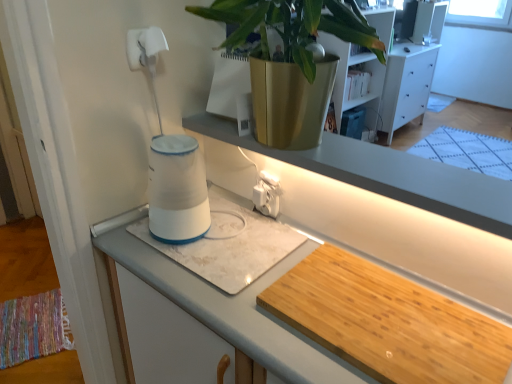
Where is `white glossy dresser at upper right`? white glossy dresser at upper right is located at coordinates (406, 86).

The image size is (512, 384). I want to click on white plastic electric outlet at center, so click(x=267, y=197).

Describe the element at coordinates (267, 197) in the screenshot. I see `white plastic electric outlet at center` at that location.

Where is `white glossy dresser at upper right`? white glossy dresser at upper right is located at coordinates (406, 86).

Considering the positions of objects white glossy window sill at upper center and white plastic electric outlet at center in the image provided, who is in front, white glossy window sill at upper center or white plastic electric outlet at center?

white glossy window sill at upper center is in front.

Considering the relative sizes of white glossy window sill at upper center and white plastic electric outlet at center in the image provided, is white glossy window sill at upper center wider than white plastic electric outlet at center?

Yes.

Is white glossy window sill at upper center turned away from white plastic electric outlet at center?

That's not correct — white glossy window sill at upper center is not looking away from white plastic electric outlet at center.

The height and width of the screenshot is (384, 512). In order to click on cabinetry located below the white plastic electric outlet at center (from the image's perspective) in this screenshot , I will do `click(225, 305)`.

From the image's perspective, is white plastic electric outlet at center positioned above or below white laminate cabinet at center?

Based on their image positions, white plastic electric outlet at center is located above white laminate cabinet at center.

Considering the sizes of objects white plastic electric outlet at center and white laminate cabinet at center in the image provided, who is thinner, white plastic electric outlet at center or white laminate cabinet at center?

white plastic electric outlet at center.

Looking at their sizes, would you say white glossy window sill at upper center is wider or thinner than white laminate cabinet at center?

Considering their sizes, white glossy window sill at upper center looks slimmer than white laminate cabinet at center.

Could white laminate cabinet at center be considered to be inside white glossy window sill at upper center?

No, white glossy window sill at upper center does not contain white laminate cabinet at center.

Considering the positions of point (385, 167) and point (314, 235), is point (385, 167) closer or farther from the camera than point (314, 235)?

Point (385, 167) is positioned closer to the camera compared to point (314, 235).

Is white plastic electric outlet at center at the right side of white glossy dresser at upper right?

In fact, white plastic electric outlet at center is to the left of white glossy dresser at upper right.

Is white plastic electric outlet at center bigger than white glossy dresser at upper right?

Actually, white plastic electric outlet at center might be smaller than white glossy dresser at upper right.

Is white laminate cabinet at center directly adjacent to white glossy window sill at upper center?

No, white laminate cabinet at center is not next to white glossy window sill at upper center.

From the image's perspective, which object appears higher, white laminate cabinet at center or white glossy window sill at upper center?

From the image's view, white glossy window sill at upper center is above.

Could you tell me if white laminate cabinet at center is turned towards white glossy window sill at upper center?

No, white laminate cabinet at center does not turn towards white glossy window sill at upper center.

Which point is more distant from viewer, (285, 365) or (426, 207)?

The point (426, 207) is more distant.

Considering the positions of point (152, 188) and point (298, 155), is point (152, 188) closer or farther from the camera than point (298, 155)?

Clearly, point (152, 188) is more distant from the camera than point (298, 155).

From the image's perspective, is white glossy water heater at center positioned above or below white glossy window sill at upper center?

Clearly, from the image's perspective, white glossy water heater at center is below white glossy window sill at upper center.

Choose the correct answer: Is white glossy water heater at center inside white glossy window sill at upper center or outside it?

white glossy water heater at center is located beyond the bounds of white glossy window sill at upper center.

Consider the image. Is white glossy water heater at center oriented away from white glossy window sill at upper center?

That's not correct — white glossy water heater at center is not looking away from white glossy window sill at upper center.

Considering the relative positions of white glossy water heater at center and white glossy cup at center, placed as the 2th wide when sorted from right to left, in the image provided, is white glossy water heater at center to the right of white glossy cup at center, placed as the 2th wide when sorted from right to left, from the viewer's perspective?

In fact, white glossy water heater at center is to the left of white glossy cup at center, placed as the 2th wide when sorted from right to left.

Who is bigger, white glossy water heater at center or white glossy cup at center, which is counted as the 1th wide, starting from the left?

With larger size is white glossy water heater at center.

Based on the photo, from a real-world perspective, is white glossy water heater at center above or below white glossy cup at center, which is counted as the 1th wide, starting from the left?

white glossy water heater at center is situated higher than white glossy cup at center, which is counted as the 1th wide, starting from the left, in the real world.

From the image's perspective, is white glossy water heater at center under white glossy cup at center, which is counted as the 1th wide, starting from the left?

No, from the image's perspective, white glossy water heater at center is not beneath white glossy cup at center, which is counted as the 1th wide, starting from the left.

Where is `electric outlet below the white glossy window sill at upper center (from the image's perspective)`? This screenshot has height=384, width=512. electric outlet below the white glossy window sill at upper center (from the image's perspective) is located at coordinates (267, 197).

In the image, there is a white laminate cabinet at center. Where is `electric outlet above it (from the image's perspective)`? electric outlet above it (from the image's perspective) is located at coordinates (267, 197).

Estimate the real-world distances between objects in this image. Which object is further from white glossy cup at center, which is counted as the 1th wide, starting from the left, white glossy window sill at upper center or white plastic electric outlet at center?

white glossy window sill at upper center.

When comparing their distances from white glossy dresser at upper right, does white glossy water heater at center or wooden cutting board at lower right, which is the 2th wide from left to right, seem further?

wooden cutting board at lower right, which is the 2th wide from left to right.

Estimate the real-world distances between objects in this image. Which object is further from white glossy water heater at center, white glossy cup at center, which is counted as the 1th wide, starting from the left, or white laminate cabinet at center?

Among the two, white laminate cabinet at center is located further to white glossy water heater at center.

Considering their positions, is white glossy window sill at upper center positioned further to white glossy cup at center, placed as the 2th wide when sorted from right to left, than white laminate cabinet at center?

Based on the image, white glossy window sill at upper center appears to be further to white glossy cup at center, placed as the 2th wide when sorted from right to left.

Considering their positions, is white laminate cabinet at center positioned closer to white glossy window sill at upper center than white glossy dresser at upper right?

Based on the image, white laminate cabinet at center appears to be nearer to white glossy window sill at upper center.

Based on their spatial positions, is white glossy dresser at upper right or white laminate cabinet at center closer to white plastic electric outlet at center?

Among the two, white laminate cabinet at center is located nearer to white plastic electric outlet at center.

Estimate the real-world distances between objects in this image. Which object is further from white glossy window sill at upper center, white plastic electric outlet at center or white glossy cup at center, which is counted as the 1th wide, starting from the left?

white plastic electric outlet at center lies further to white glossy window sill at upper center than the other object.

Estimate the real-world distances between objects in this image. Which object is further from white glossy cup at center, which is counted as the 1th wide, starting from the left, white laminate cabinet at center or wooden cutting board at lower right, which is the 2th wide from left to right?

wooden cutting board at lower right, which is the 2th wide from left to right, lies further to white glossy cup at center, which is counted as the 1th wide, starting from the left, than the other object.

This screenshot has width=512, height=384. I want to click on wide situated between white glossy water heater at center and white glossy window sill at upper center from left to right, so click(230, 248).

Identify the location of water heater located between white glossy cup at center, which is counted as the 1th wide, starting from the left, and white glossy dresser at upper right in the depth direction. (177, 190).

The image size is (512, 384). What are the coordinates of `window sill between white laminate cabinet at center and white glossy dresser at upper right in the front-back direction` in the screenshot? It's located at (387, 174).

What are the coordinates of `window sill between white glossy cup at center, which is counted as the 1th wide, starting from the left, and wooden cutting board at lower right, which ranks as the 1th wide in right-to-left order, from left to right` in the screenshot? It's located at (387, 174).